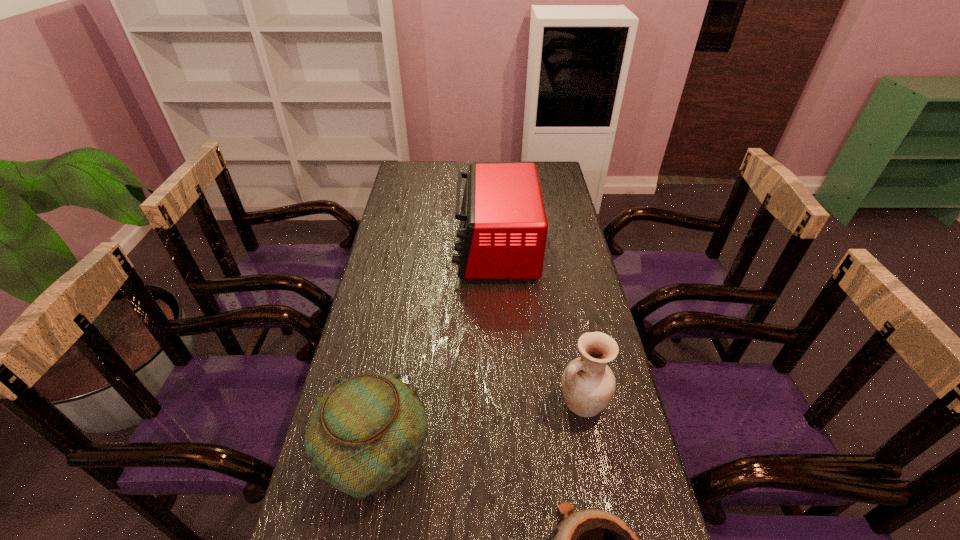
The height and width of the screenshot is (540, 960). In order to click on toaster oven in this screenshot , I will do `click(503, 229)`.

Where is `the leftmost object`? Image resolution: width=960 pixels, height=540 pixels. the leftmost object is located at coordinates (365, 434).

Where is `vacant space situated 0.260m on the front-facing side of the farthest object`? Image resolution: width=960 pixels, height=540 pixels. vacant space situated 0.260m on the front-facing side of the farthest object is located at coordinates (382, 248).

Locate an element on the screen. This screenshot has width=960, height=540. free space located on the front-facing side of the farthest object is located at coordinates (394, 248).

Where is `vacant space located on the front-facing side of the farthest object`? This screenshot has width=960, height=540. vacant space located on the front-facing side of the farthest object is located at coordinates (432, 248).

At what (x,y) coordinates should I click in order to perform the action: click on vacant space located on the right of the leftmost object. Please return your answer as a coordinate pair (x, y). Looking at the image, I should click on (491, 455).

Where is `object located at the left edge`? The height and width of the screenshot is (540, 960). object located at the left edge is located at coordinates (365, 434).

Locate an element on the screen. This screenshot has width=960, height=540. object located at the right edge is located at coordinates coord(588,384).

In the image, there is a desktop. Where is `free space at the left edge`? The height and width of the screenshot is (540, 960). free space at the left edge is located at coordinates (384, 268).

At what (x,y) coordinates should I click in order to perform the action: click on vacant space at the right edge of the desktop. Please return your answer as a coordinate pair (x, y). This screenshot has height=540, width=960. Looking at the image, I should click on (585, 425).